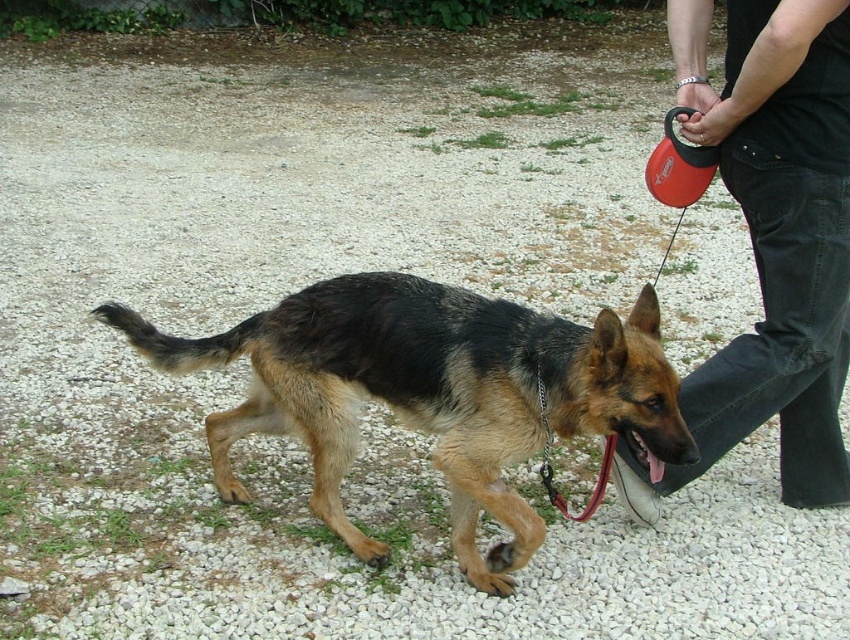
Does black and tan fur dog at center have a lesser width compared to dark blue jeans at right?

In fact, black and tan fur dog at center might be wider than dark blue jeans at right.

Does point (581, 336) lie in front of point (701, 144)?

Yes.

Where is `black and tan fur dog at center`? This screenshot has width=850, height=640. black and tan fur dog at center is located at coordinates coord(432,392).